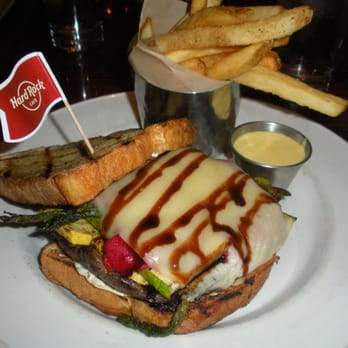
You are a GUI agent. You are given a task and a screenshot of the screen. Output one action in this format:
    pyautogui.click(x=<x>, y=<y>)
    Task: Click on the white plate
    This screenshot has height=348, width=348.
    Given the screenshot: What is the action you would take?
    pyautogui.click(x=300, y=318)